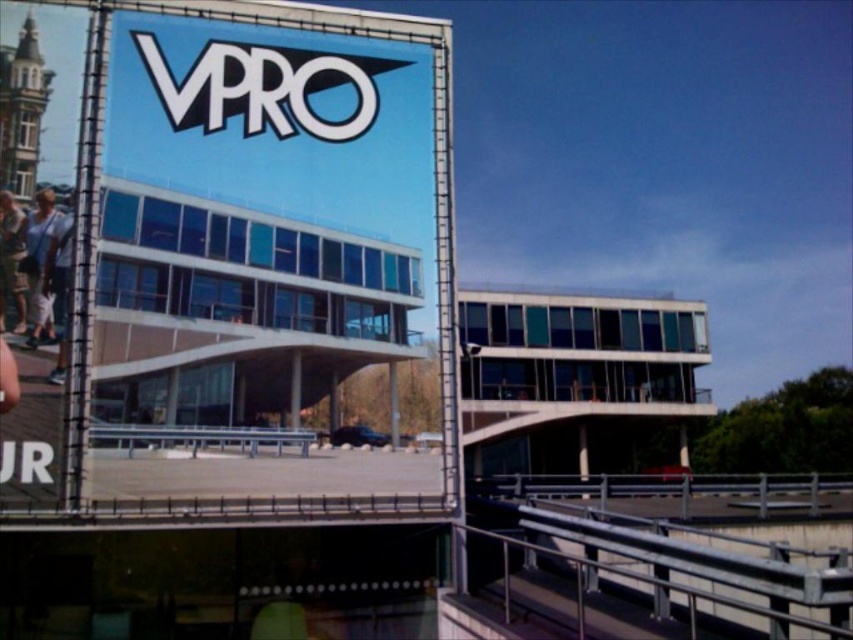
Question: Is blue glossy sign at upper center above white glossy sign at upper center?

Choices:
 (A) yes
 (B) no

Answer: (B)

Question: Which of the following is the farthest from the observer?

Choices:
 (A) (274, 115)
 (B) (328, 227)

Answer: (A)

Question: Which of the following is the closest to the observer?

Choices:
 (A) blue glossy sign at upper center
 (B) white glossy sign at upper center

Answer: (A)

Question: Does blue glossy sign at upper center have a larger size compared to white glossy sign at upper center?

Choices:
 (A) no
 (B) yes

Answer: (B)

Question: Is blue glossy sign at upper center bigger than white glossy sign at upper center?

Choices:
 (A) no
 (B) yes

Answer: (B)